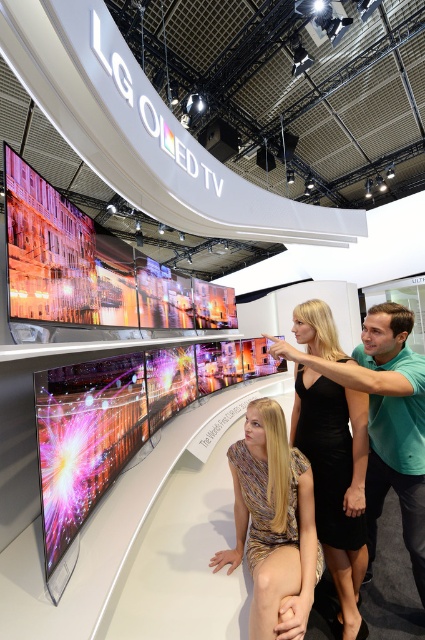
Is metallic gold dress at center positioned behind green matte shirt at center?

That is False.

Find the location of `metallic gold dress at center`. metallic gold dress at center is located at coordinates (272, 524).

Locate an element on the screen. This screenshot has height=640, width=425. metallic gold dress at center is located at coordinates (272, 524).